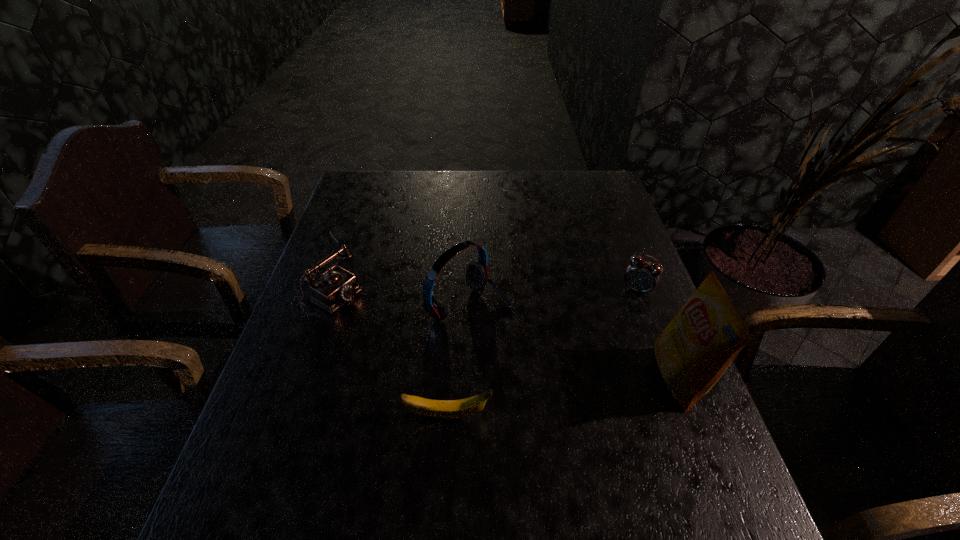
At what (x,y) coordinates should I click in order to perform the action: click on alarm clock located at the right edge. Please return your answer as a coordinate pair (x, y). This screenshot has height=540, width=960. Looking at the image, I should click on [642, 276].

This screenshot has width=960, height=540. What are the coordinates of `free space at the far edge` in the screenshot? It's located at (443, 201).

The height and width of the screenshot is (540, 960). What are the coordinates of `vacant space at the left edge` in the screenshot? It's located at (333, 395).

Identify the location of vacant region at the right edge of the desktop. (630, 400).

At what (x,y) coordinates should I click in order to perform the action: click on vacant space at the far right corner of the desktop. Please return your answer as a coordinate pair (x, y). Looking at the image, I should click on (571, 194).

Locate an element on the screen. The width and height of the screenshot is (960, 540). vacant space at the near right corner of the desktop is located at coordinates [636, 450].

The width and height of the screenshot is (960, 540). I want to click on free spot between the leftmost object and the tallest object, so click(510, 326).

Find the location of a particular element. This screenshot has width=960, height=540. empty space that is in between the telephone and the second tallest object is located at coordinates (404, 288).

I want to click on blank region between the telephone and the banana, so click(394, 345).

Where is `unoccupied area between the tallest object and the leftmost object`? This screenshot has height=540, width=960. unoccupied area between the tallest object and the leftmost object is located at coordinates (510, 326).